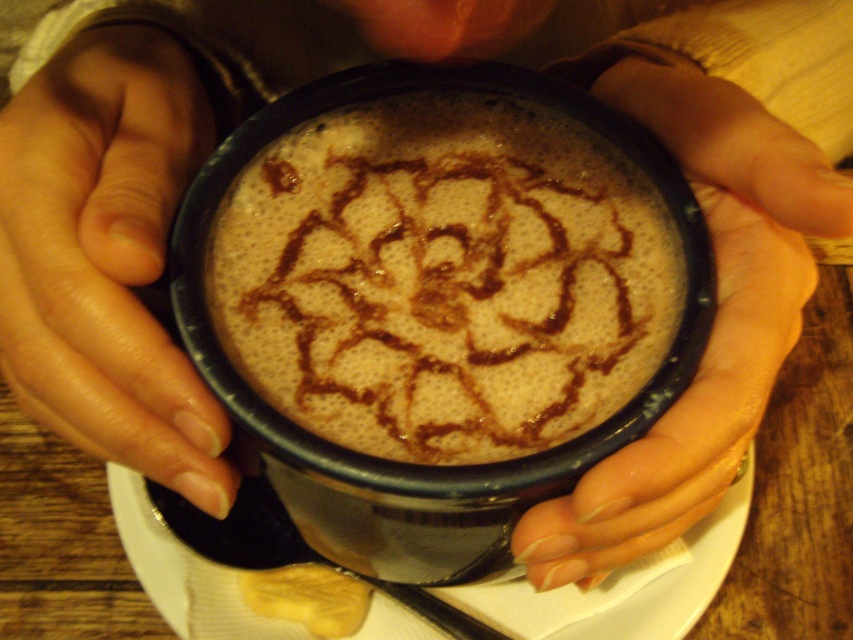
Question: Based on their relative distances, which object is nearer to the brown frothy coffee at center?

Choices:
 (A) nail polish coated nails at lower left
 (B) nail polish coated fingers at center

Answer: (B)

Question: Is nail polish coated nails at lower left bigger than white paper napkin at center?

Choices:
 (A) yes
 (B) no

Answer: (B)

Question: Which is farther from the brown frothy coffee at center?

Choices:
 (A) nail polish coated fingers at center
 (B) nail polish coated nails at lower left

Answer: (B)

Question: Does nail polish coated nails at lower left appear on the right side of nail polish coated fingers at center?

Choices:
 (A) no
 (B) yes

Answer: (A)

Question: Is brown frothy coffee at center above white paper napkin at center?

Choices:
 (A) no
 (B) yes

Answer: (B)

Question: Which object appears farthest from the camera in this image?

Choices:
 (A) brown frothy coffee at center
 (B) nail polish coated fingers at center

Answer: (A)